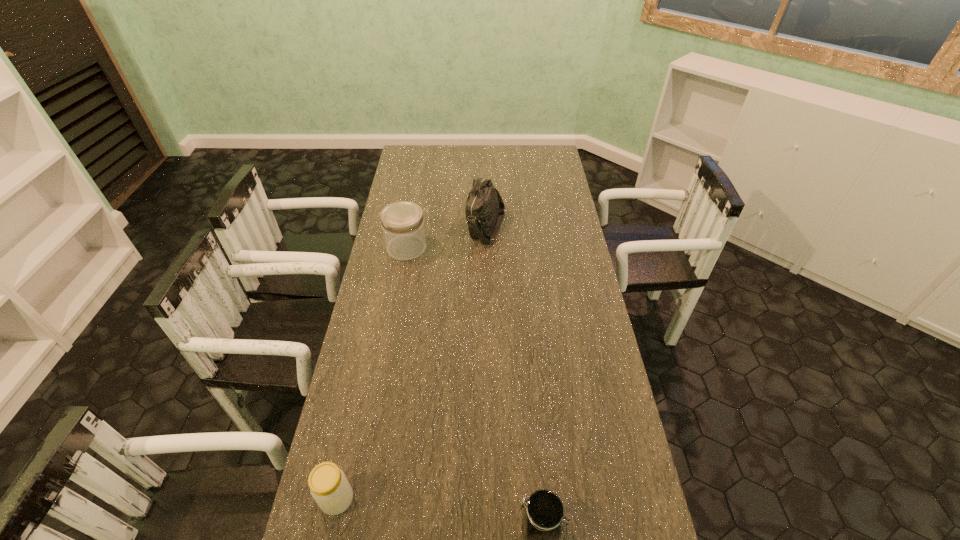
At what (x,y) coordinates should I click in order to perform the action: click on free area in between the farthest jar and the tallest object. Please return your answer as a coordinate pair (x, y). The width and height of the screenshot is (960, 540). Looking at the image, I should click on (446, 237).

Where is `free area in between the farthest jar and the shoulder bag`? free area in between the farthest jar and the shoulder bag is located at coordinates (446, 237).

Identify which object is located as the second nearest to the farthest jar. Please provide its 2D coordinates. Your answer should be formatted as a tuple, i.e. [(x, y)], where the tuple contains the x and y coordinates of a point satisfying the conditions above.

[(329, 487)]

Locate an element on the screen. object that can be found as the second closest to the shoulder bag is located at coordinates (329, 487).

Image resolution: width=960 pixels, height=540 pixels. Identify the location of jar that is the second closest one to the farthest jar. (543, 511).

Choose which jar is the third nearest neighbor to the tallest object. Please provide its 2D coordinates. Your answer should be formatted as a tuple, i.e. [(x, y)], where the tuple contains the x and y coordinates of a point satisfying the conditions above.

[(543, 511)]

Where is `vacant space that satisfies the following two spatial constraints: 1. at the front padded panel of the shoulder bag; 2. on the front side of the farthest jar`? This screenshot has height=540, width=960. vacant space that satisfies the following two spatial constraints: 1. at the front padded panel of the shoulder bag; 2. on the front side of the farthest jar is located at coordinates (487, 248).